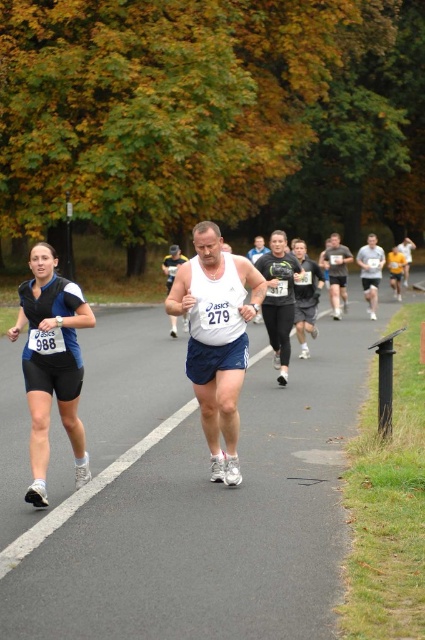
You are a photographer positioned at the starting line of the marathon. You want to capture a photo that includes both the gray fabric shirt at right and the white tank top at center. Since you need to ensure both are visible, which runner should you focus on first to frame the shot properly?

The gray fabric shirt at right is taller than the white tank top at center, so you should focus on the gray fabric shirt at right first to ensure it fits within the frame since it is taller.

You are a photographer positioned at the starting line of the marathon. You want to take a photo of both the white matte tank top at center and the white tank top at center. Which one should you focus on first to ensure both are in the frame?

The white matte tank top at center is in front of the white tank top at center, so you should focus on the white matte tank top at center first to ensure both are in the frame by adjusting the camera angle to include both.